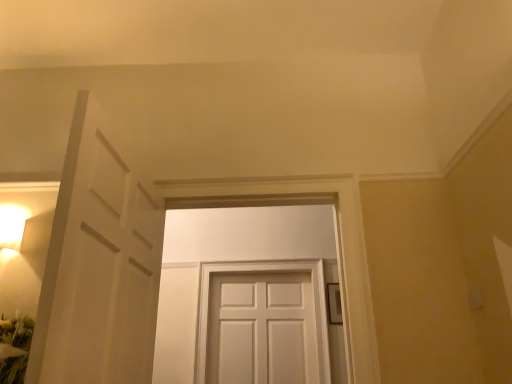
Question: Should I look upward or downward to see white matte door at center, the 2th door viewed from the front?

Choices:
 (A) up
 (B) down

Answer: (B)

Question: Is white matte door at center, which appears as the first door when viewed from the back, not near white matte door at center, which is the 1th door from front to back?

Choices:
 (A) no
 (B) yes

Answer: (A)

Question: Is white matte door at center, which appears as the first door when viewed from the back, to the left of white matte door at center, the 1th door from the top, from the viewer's perspective?

Choices:
 (A) no
 (B) yes

Answer: (A)

Question: Can you confirm if white matte door at center, which appears as the first door when viewed from the back, is thinner than white matte door at center, which is the 1th door from front to back?

Choices:
 (A) no
 (B) yes

Answer: (B)

Question: Is white matte door at center, the 2th door in the top-to-bottom sequence, positioned before white matte door at center, the 1th door from the top?

Choices:
 (A) yes
 (B) no

Answer: (B)

Question: Is white matte door at center, the second door in the bottom-to-top sequence, located within white matte door at center, the 2th door viewed from the front?

Choices:
 (A) yes
 (B) no

Answer: (B)

Question: Can you confirm if white matte door at center, the 2th door viewed from the front, is bigger than white matte door at center, the second door positioned from the back?

Choices:
 (A) yes
 (B) no

Answer: (B)

Question: Is white matte door at center, the 1th door from the top, to the left of white matte door at center, which appears as the first door when viewed from the back, from the viewer's perspective?

Choices:
 (A) no
 (B) yes

Answer: (B)

Question: From a real-world perspective, is white matte door at center, which is the 1th door from front to back, on top of white matte door at center, the 2th door viewed from the front?

Choices:
 (A) no
 (B) yes

Answer: (B)

Question: Can you confirm if white matte door at center, the 1th door from the top, is taller than white matte door at center, the 2th door in the top-to-bottom sequence?

Choices:
 (A) no
 (B) yes

Answer: (B)

Question: From a real-world perspective, is white matte door at center, which is the 1th door from front to back, under white matte door at center, the 2th door viewed from the front?

Choices:
 (A) yes
 (B) no

Answer: (B)

Question: Is white matte door at center, the second door positioned from the back, oriented away from white matte door at center, acting as the 1th door starting from the bottom?

Choices:
 (A) yes
 (B) no

Answer: (A)

Question: Is white matte door at center, the second door in the bottom-to-top sequence, positioned before white matte door at center, acting as the 1th door starting from the bottom?

Choices:
 (A) yes
 (B) no

Answer: (A)

Question: From a real-world perspective, is white matte door at center, which appears as the first door when viewed from the back, positioned above or below white matte door at center, the second door in the bottom-to-top sequence?

Choices:
 (A) below
 (B) above

Answer: (A)